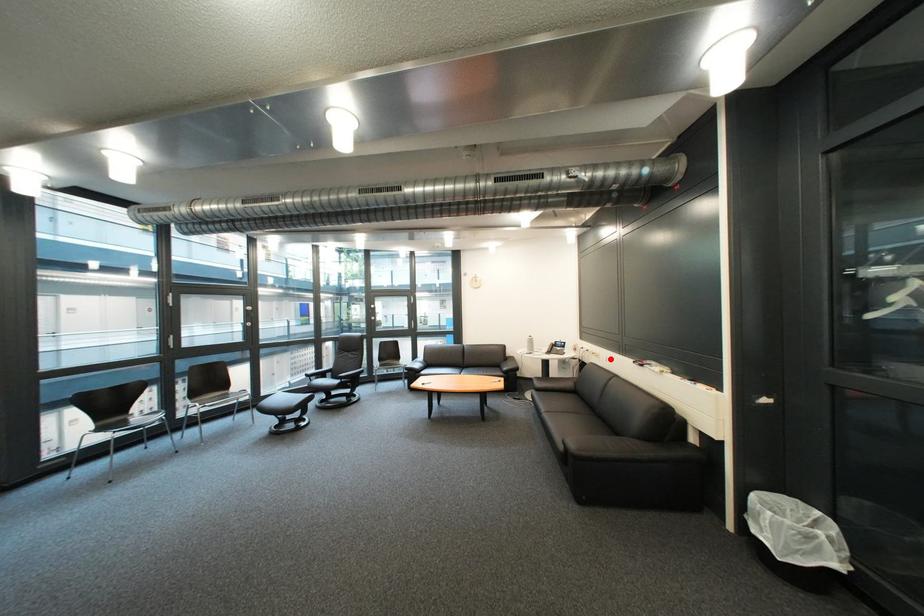
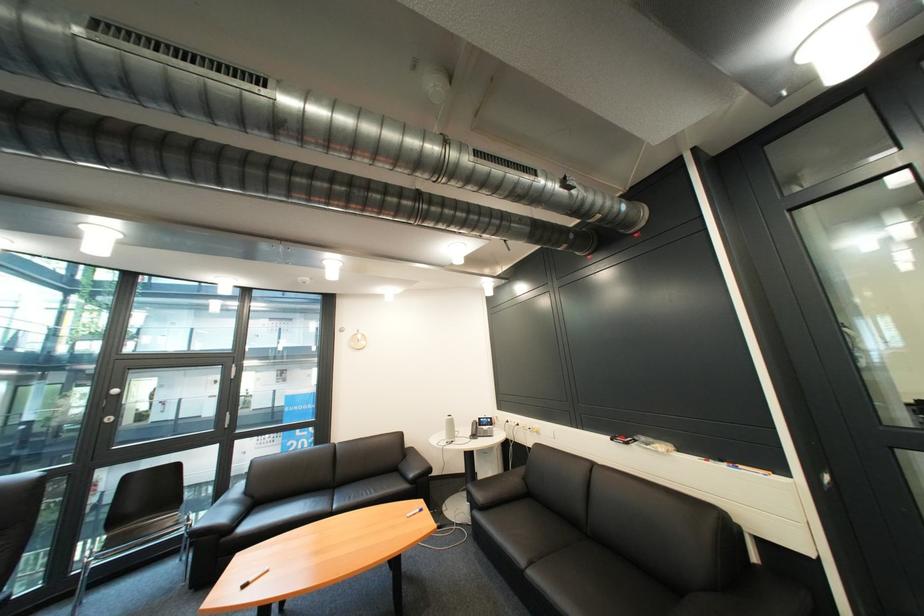
Find the pixel in the second image that matches the highlighted location in the first image.

(549, 435)